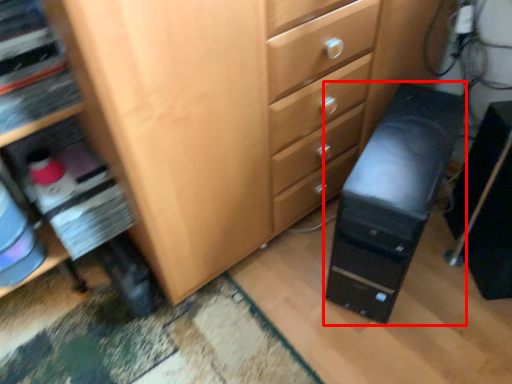
Question: Observing the image, what is the correct spatial positioning of computer tower (annotated by the red box) in reference to computer tower?

Choices:
 (A) left
 (B) right

Answer: (A)